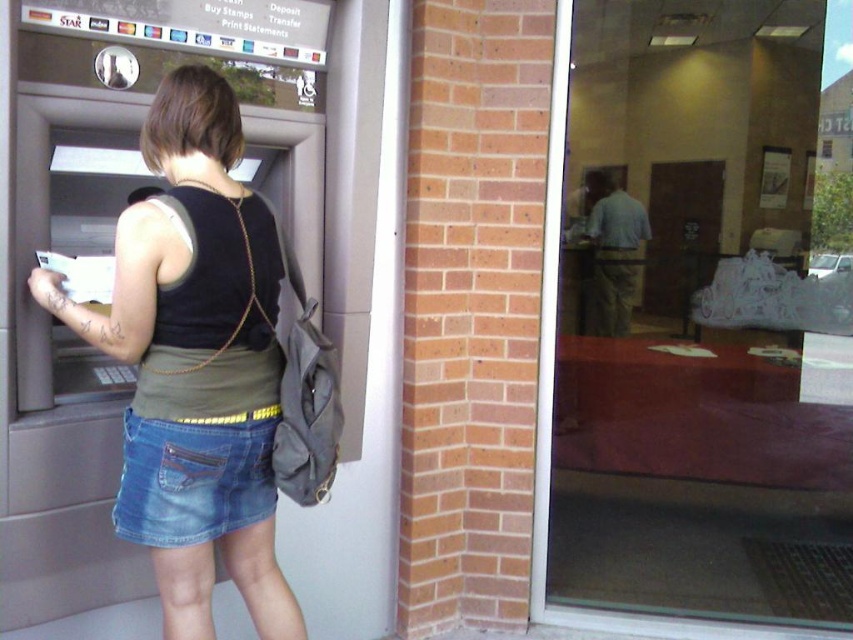
From the picture: You are a fashion designer observing a person wearing a denim skirt at center and a black matte vest at back. Which clothing item is wider?

The denim skirt at center is wider than the black matte vest at back.

Based on the scene description, which clothing item is closer to the observer, the denim skirt at center or the jeans at lower left?

The denim skirt at center is closer to the observer because it is in front of the jeans at lower left.